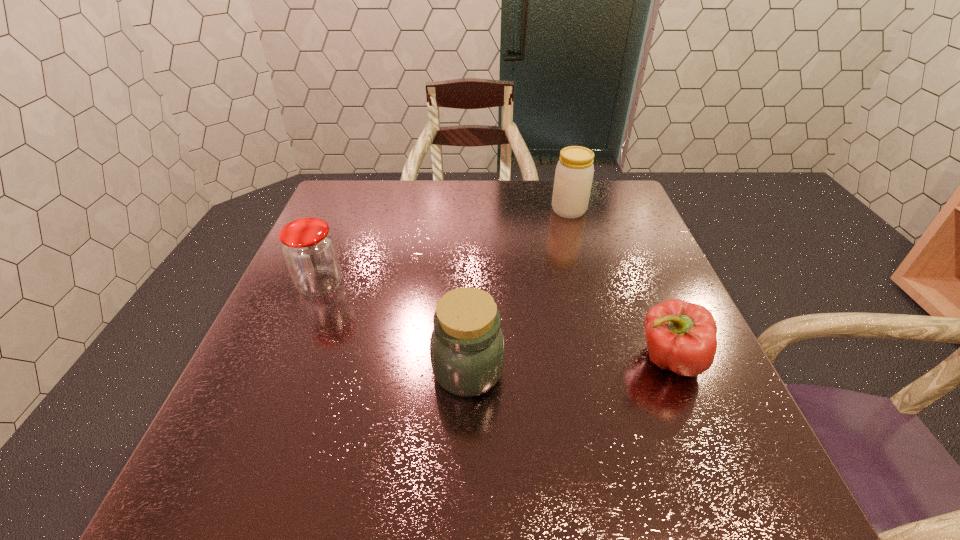
Where is `the farthest jar`? Image resolution: width=960 pixels, height=540 pixels. the farthest jar is located at coordinates (574, 172).

The height and width of the screenshot is (540, 960). In order to click on the rightmost jar in this screenshot , I will do `click(574, 172)`.

Image resolution: width=960 pixels, height=540 pixels. What are the coordinates of `the second jar from right to left` in the screenshot? It's located at (467, 348).

Image resolution: width=960 pixels, height=540 pixels. In order to click on the second object from left to right in this screenshot , I will do `click(467, 348)`.

The image size is (960, 540). I want to click on the leftmost object, so click(x=309, y=250).

Where is `the second farthest jar`? Image resolution: width=960 pixels, height=540 pixels. the second farthest jar is located at coordinates (309, 250).

Find the location of a particular element. The height and width of the screenshot is (540, 960). bell pepper is located at coordinates (681, 336).

Find the location of a particular element. This screenshot has width=960, height=540. blank space located on the left of the rightmost jar is located at coordinates (458, 210).

The image size is (960, 540). I want to click on blank space located 0.060m on the front of the nearest jar, so click(x=467, y=432).

You are a GUI agent. You are given a task and a screenshot of the screen. Output one action in this format:
    pyautogui.click(x=<x>, y=<y>)
    Task: Click on the free space located 0.320m on the right of the leftmost object
    The image size is (960, 540).
    Given the screenshot: What is the action you would take?
    pyautogui.click(x=481, y=285)